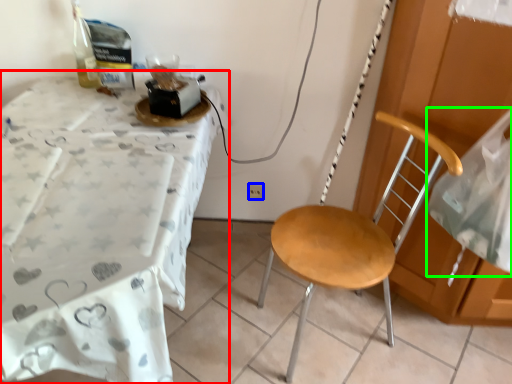
Question: Which object is positioned farthest from desk (highlighted by a red box)? Select from power outlet (highlighted by a blue box) and sheet (highlighted by a green box).

Choices:
 (A) power outlet
 (B) sheet

Answer: (B)